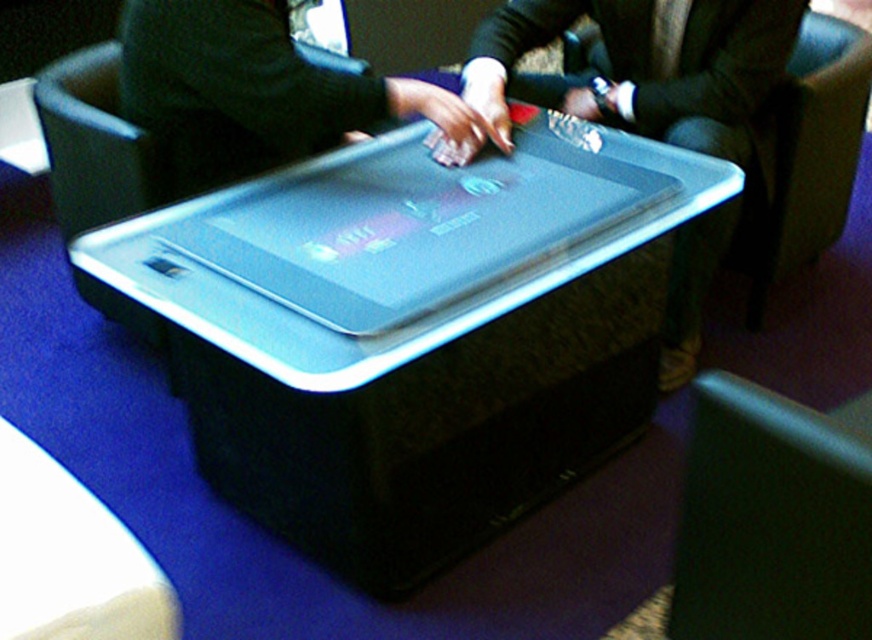
Question: Can you confirm if clear plastic tray at center is positioned below matte gray tablet at center?

Choices:
 (A) no
 (B) yes

Answer: (B)

Question: Which point is farther to the camera?

Choices:
 (A) (360, 433)
 (B) (760, 253)
 (C) (807, 426)

Answer: (B)

Question: Which is farther from the matte gray tablet at center?

Choices:
 (A) dark green fabric armchair at right
 (B) clear plastic tray at center

Answer: (A)

Question: Observing the image, what is the correct spatial positioning of clear plastic tray at center in reference to matte gray tablet at center?

Choices:
 (A) left
 (B) right

Answer: (A)

Question: Which of the following is the farthest from the observer?

Choices:
 (A) (356, 268)
 (B) (751, 321)

Answer: (B)

Question: Does matte gray tablet at center appear on the right side of dark green fabric armchair at right?

Choices:
 (A) no
 (B) yes

Answer: (A)